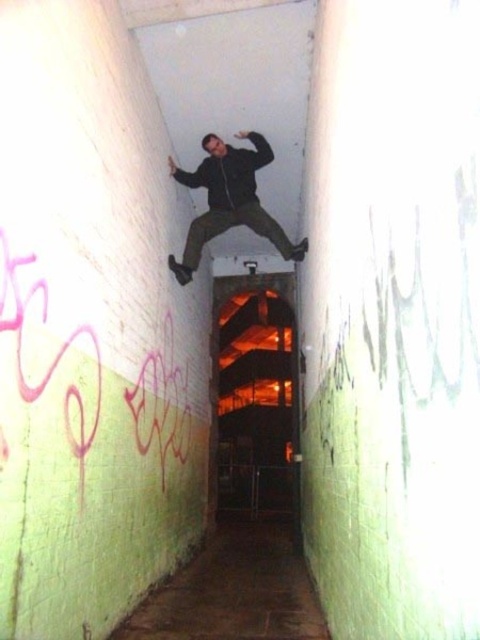
Question: Can you confirm if pink graffiti at left is positioned to the left of matte black jacket at center?

Choices:
 (A) yes
 (B) no

Answer: (A)

Question: Is pink graffiti at left to the left of matte black jacket at center from the viewer's perspective?

Choices:
 (A) no
 (B) yes

Answer: (B)

Question: Does pink graffiti at left have a smaller size compared to matte black jacket at center?

Choices:
 (A) no
 (B) yes

Answer: (B)

Question: Which of the following is the closest to the observer?

Choices:
 (A) matte black jacket at center
 (B) pink graffiti at left

Answer: (B)

Question: Which of the following is the closest to the observer?

Choices:
 (A) pink graffiti at left
 (B) matte black jacket at center

Answer: (A)